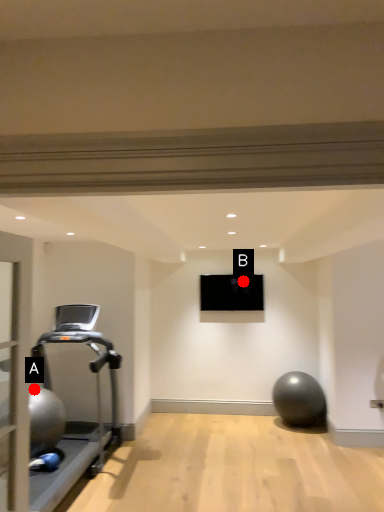
Question: Two points are circled on the image, labeled by A and B beside each circle. Among these points, which one is farthest from the camera?

Choices:
 (A) A is further
 (B) B is further

Answer: (B)